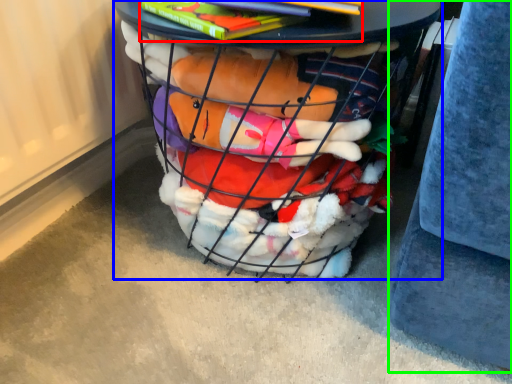
Question: Estimate the real-world distances between objects in this image. Which object is closer to book (highlighted by a red box), furniture (highlighted by a blue box) or gray (highlighted by a green box)?

Choices:
 (A) furniture
 (B) gray

Answer: (A)